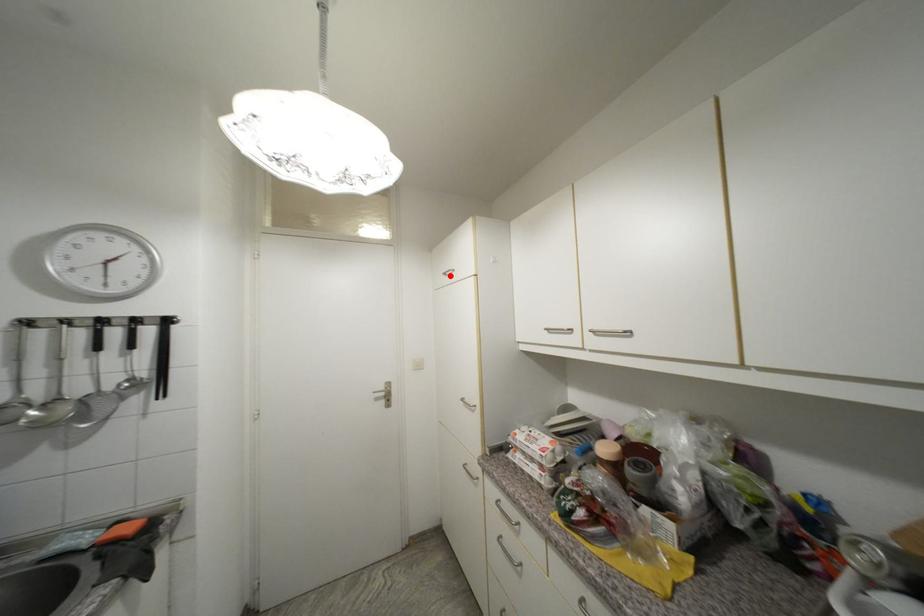
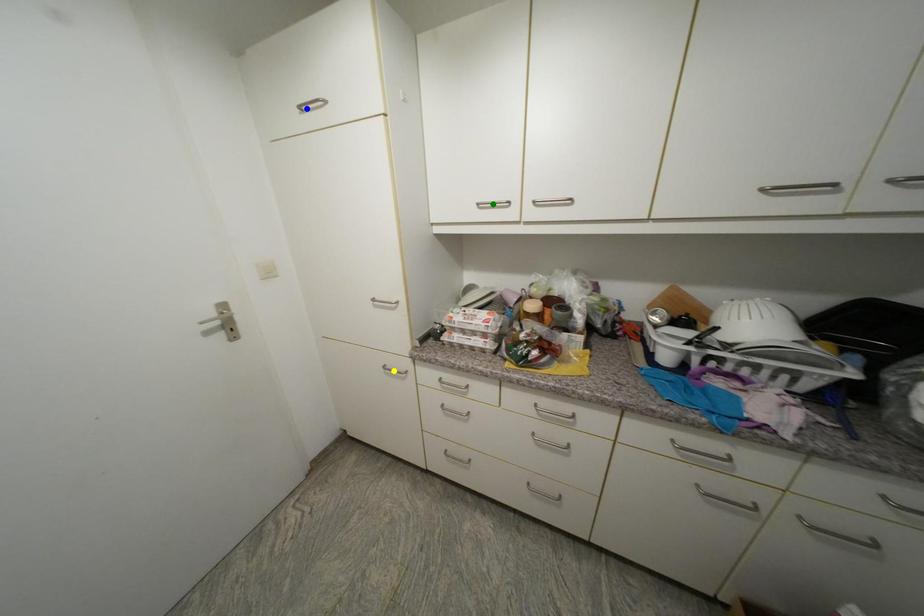
Question: I am providing you with two images of the same scene from different viewpoints. A red point is marked on the first image. You are given multiple points on the second image. Can you choose the point in image 2 that corresponds to the point in image 1?

Choices:
 (A) blue point
 (B) green point
 (C) yellow point

Answer: (A)